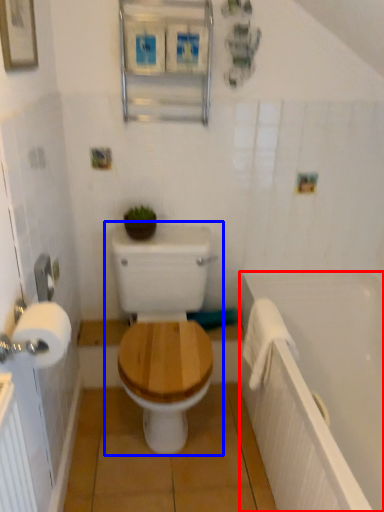
Question: Which object is further to the camera taking this photo, bath (highlighted by a red box) or toilet (highlighted by a blue box)?

Choices:
 (A) bath
 (B) toilet

Answer: (B)